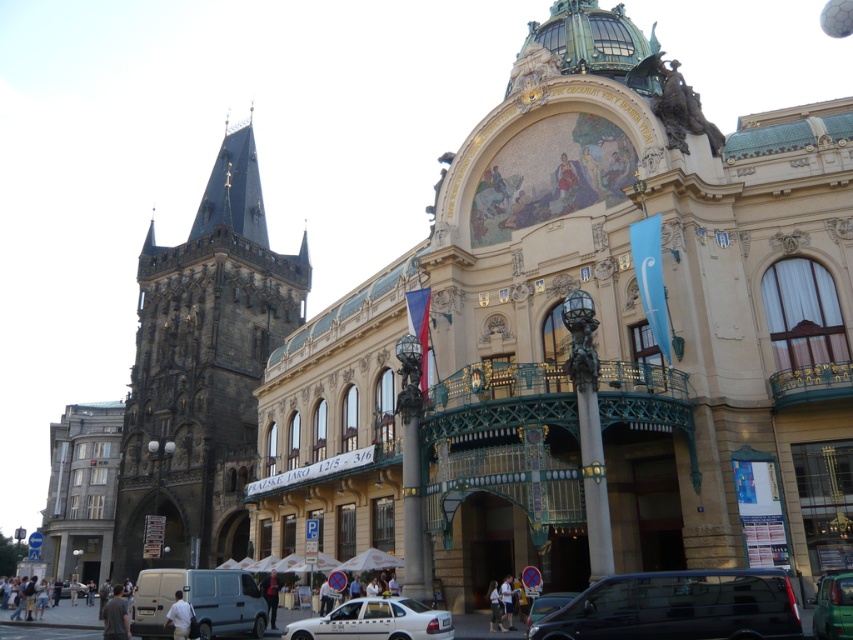
You are a drone operator trying to capture aerial footage of the two points in the scene. The first point is labeled as point (679,550) and the second is point (606,618). To ensure both points are visible in the same frame, which point should you position the drone closer to?

You should position the drone closer to point (606,618) because point (679,550) is behind it, so getting closer to the front point will allow both to be in the frame.

You are a photographer standing in the middle of the urban scene. You notice two points marked in the image. The first point is at coordinate point (68, 570) and the second is at point (839, 600). Which point is closer to your camera?

Point (68, 570) is further to the camera than point (839, 600). Therefore, the second point at (839, 600) is closer to your camera.